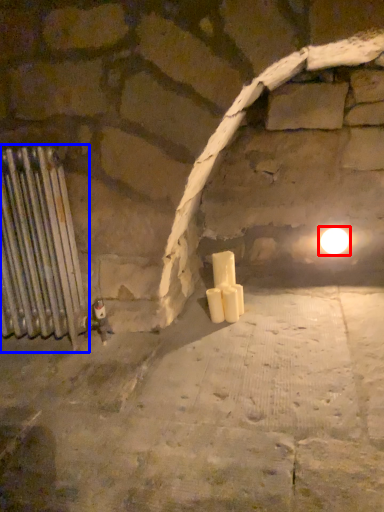
Question: Among these objects, which one is nearest to the camera, light (highlighted by a red box) or radiator (highlighted by a blue box)?

Choices:
 (A) light
 (B) radiator

Answer: (B)